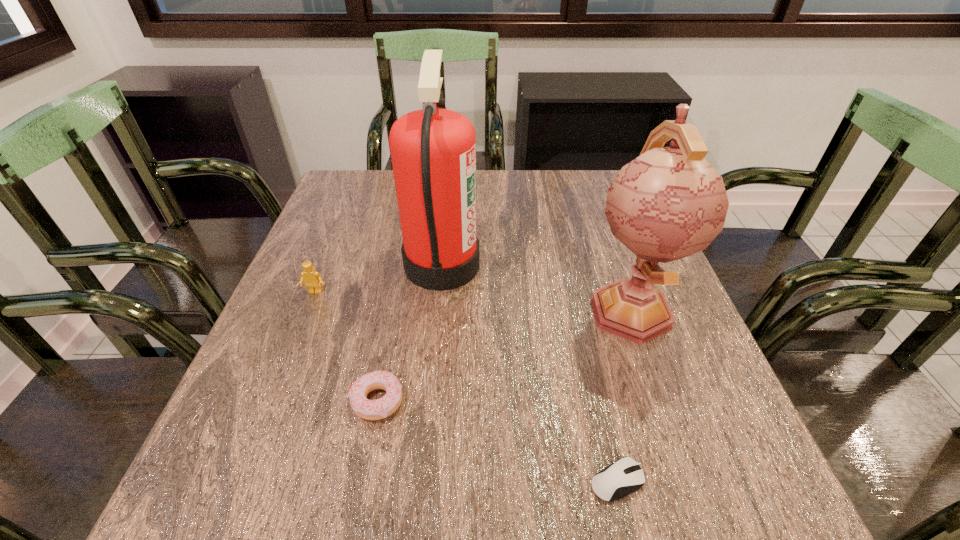
Where is `fire extinguisher`? fire extinguisher is located at coordinates (433, 151).

The image size is (960, 540). In order to click on globe in this screenshot , I will do `click(668, 203)`.

The image size is (960, 540). What are the coordinates of `the third shortest object` in the screenshot? It's located at (313, 281).

The width and height of the screenshot is (960, 540). In order to click on Lego in this screenshot , I will do `click(313, 281)`.

Locate an element on the screen. the second shortest object is located at coordinates (381, 408).

Locate an element on the screen. This screenshot has height=540, width=960. the second nearest object is located at coordinates (381, 408).

This screenshot has width=960, height=540. I want to click on mouse, so click(x=625, y=476).

The image size is (960, 540). I want to click on the shortest object, so click(x=625, y=476).

Locate an element on the screen. free point located at the nozzle of the fire extinguisher is located at coordinates (582, 264).

Locate an element on the screen. vacant space situated 0.050m on the front-facing side of the globe is located at coordinates pos(653,377).